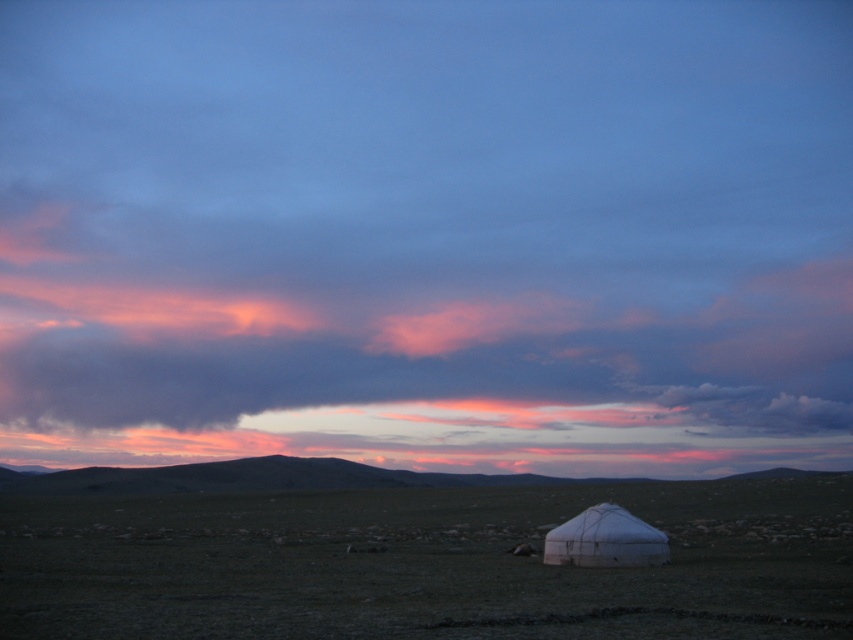
Between dark gray cloud at upper center and smooth earthy horizon at center, which one has less height?

Standing shorter between the two is smooth earthy horizon at center.

Which is below, dark gray cloud at upper center or smooth earthy horizon at center?

smooth earthy horizon at center is lower down.

Does point (318, 220) come farther from viewer compared to point (248, 467)?

Yes, point (318, 220) is behind point (248, 467).

What are the coordinates of `dark gray cloud at upper center` in the screenshot? It's located at (427, 310).

Between green grassland at lower center and smooth earthy horizon at center, which one is positioned lower?

smooth earthy horizon at center

Who is taller, green grassland at lower center or smooth earthy horizon at center?

Standing taller between the two is smooth earthy horizon at center.

Is point (42, 522) behind point (808, 474)?

No, it is in front of (808, 474).

Identify the location of green grassland at lower center. The height and width of the screenshot is (640, 853). (426, 563).

Can you confirm if dark gray cloud at upper center is positioned below white fabric tent at lower center?

Actually, dark gray cloud at upper center is above white fabric tent at lower center.

Between dark gray cloud at upper center and white fabric tent at lower center, which one appears on the left side from the viewer's perspective?

Positioned to the left is dark gray cloud at upper center.

What do you see at coordinates (427, 310) in the screenshot? The width and height of the screenshot is (853, 640). I see `dark gray cloud at upper center` at bounding box center [427, 310].

The image size is (853, 640). I want to click on dark gray cloud at upper center, so click(427, 310).